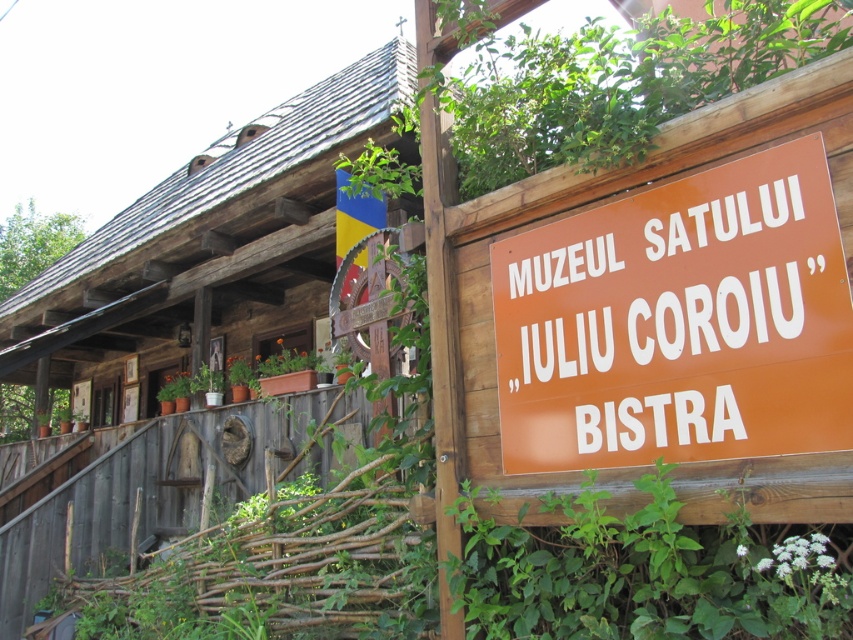
Question: Is brown wooden log cabin at upper left positioned in front of orange matte sign at center?

Choices:
 (A) no
 (B) yes

Answer: (A)

Question: Which object is farther from the camera taking this photo?

Choices:
 (A) brown wooden log cabin at upper left
 (B) orange matte sign at center

Answer: (A)

Question: From the image, what is the correct spatial relationship of brown wooden log cabin at upper left in relation to orange matte sign at center?

Choices:
 (A) below
 (B) above

Answer: (B)

Question: Which object appears closest to the camera in this image?

Choices:
 (A) brown wooden log cabin at upper left
 (B) orange matte sign at center

Answer: (B)

Question: Considering the relative positions of brown wooden log cabin at upper left and orange matte sign at center in the image provided, where is brown wooden log cabin at upper left located with respect to orange matte sign at center?

Choices:
 (A) above
 (B) below

Answer: (A)

Question: Which point is farther to the camera?

Choices:
 (A) (299, 337)
 (B) (596, 348)

Answer: (A)